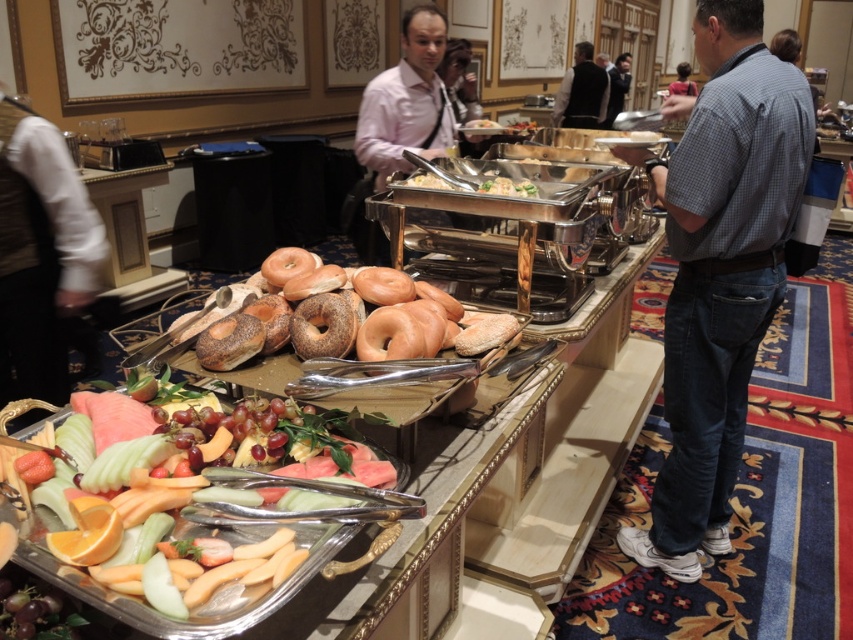
Question: Considering the real-world distances, which object is farthest from the pink shirt at center?

Choices:
 (A) smooth gray shirt at center
 (B) brown matte bagel at center
 (C) denim jeans at center

Answer: (A)

Question: Is denim jeans at center to the left of pink shirt at center from the viewer's perspective?

Choices:
 (A) no
 (B) yes

Answer: (A)

Question: Which of these objects is positioned closest to the denim jeans at center?

Choices:
 (A) dark gray shirt at center
 (B) glossy metallic tray with assorted fruits at lower left
 (C) brown matte bagel at center
 (D) pink shirt at center

Answer: (C)

Question: Can you confirm if dark gray shirt at center is positioned to the left of smooth gray shirt at center?

Choices:
 (A) yes
 (B) no

Answer: (A)

Question: Which of the following is the farthest from the observer?

Choices:
 (A) (624, 99)
 (B) (367, 116)
 (C) (567, 70)

Answer: (A)

Question: Is brown matte bagel at center bigger than smooth gray shirt at center?

Choices:
 (A) no
 (B) yes

Answer: (A)